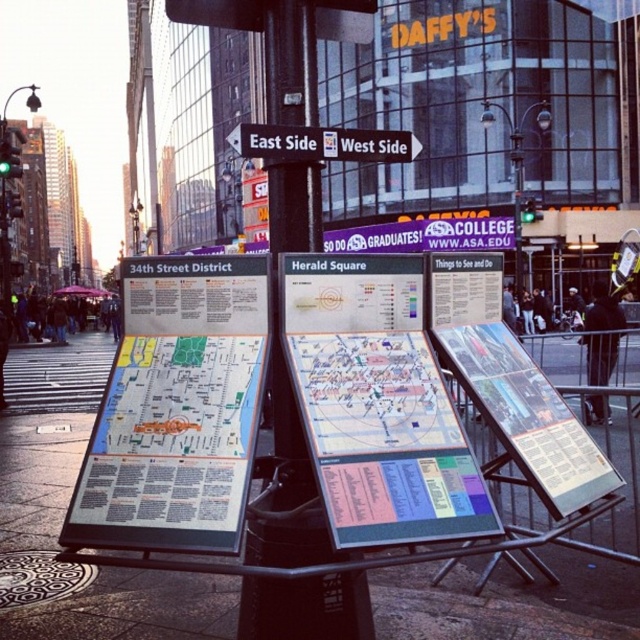
You are a tourist in New York City and need to find the nearest subway station. You see a point marked at coordinates (177, 410) on the map. Where is this point located?

The point at (177, 410) is located at the center of the white paper map.

You are a tourist holding a 12 inch ruler. You want to measure the distance between the white paper map at center and the white plastic street sign at center. Can you do it with just the ruler?

The distance between the white paper map at center and the white plastic street sign at center is 39.03 inches. Since your ruler is only 12 inches long, you would need to make multiple measurements to cover the entire distance.

You are a delivery robot with a 3.28 feet wide package. You need to navigate through the space between the smooth concrete pavement at center and the white plastic street sign at center. Can your package fit through the space between them?

The space between the smooth concrete pavement at center and the white plastic street sign at center is 14.31 feet, which is wider than the 3.28 feet width of the package. Therefore, the package can fit through the space between them.